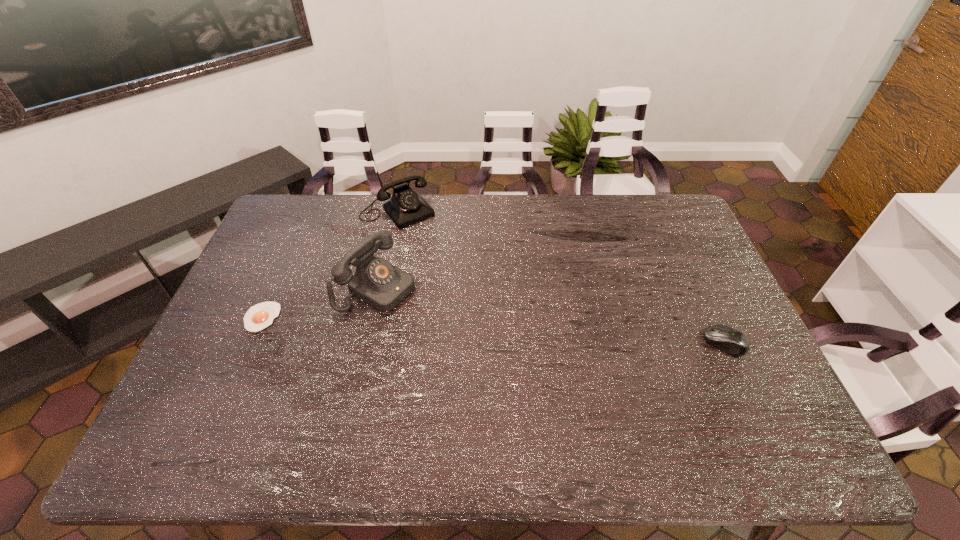
You are a GUI agent. You are given a task and a screenshot of the screen. Output one action in this format:
    pyautogui.click(x=<x>, y=<y>)
    Task: Click on the free space between the shortest object and the shorter telephone
    The width and height of the screenshot is (960, 540).
    Given the screenshot: What is the action you would take?
    pyautogui.click(x=329, y=264)

The width and height of the screenshot is (960, 540). I want to click on free point between the farthest object and the leftmost object, so click(x=329, y=264).

Where is `vacant area that lies between the shortest object and the third tallest object`? The image size is (960, 540). vacant area that lies between the shortest object and the third tallest object is located at coordinates (492, 330).

This screenshot has height=540, width=960. I want to click on the third closest object to the farthest object, so click(727, 339).

Locate an element on the screen. The height and width of the screenshot is (540, 960). object that stands as the closest to the farther telephone is located at coordinates (382, 285).

Where is `vacant space that satisfies the following two spatial constraints: 1. on the back side of the nearer telephone; 2. on the right side of the leftmost object`? vacant space that satisfies the following two spatial constraints: 1. on the back side of the nearer telephone; 2. on the right side of the leftmost object is located at coordinates (276, 286).

This screenshot has width=960, height=540. What are the coordinates of `blank space that satisfies the following two spatial constraints: 1. on the front side of the shortest object; 2. on the left side of the mouse` in the screenshot? It's located at (250, 343).

Image resolution: width=960 pixels, height=540 pixels. Find the location of `vacant space that satisfies the following two spatial constraints: 1. on the back side of the farthest object; 2. on the left side of the shortest object`. vacant space that satisfies the following two spatial constraints: 1. on the back side of the farthest object; 2. on the left side of the shortest object is located at coordinates (308, 212).